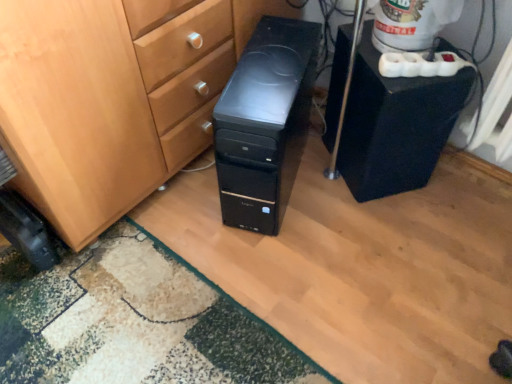
Image resolution: width=512 pixels, height=384 pixels. Find the location of `blank space situated above black plastic speaker at right (from a real-world perspective)`. blank space situated above black plastic speaker at right (from a real-world perspective) is located at coordinates coord(408,67).